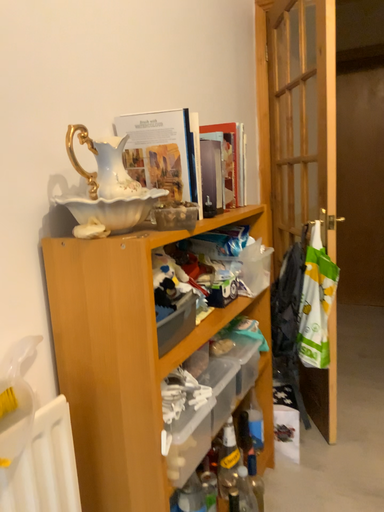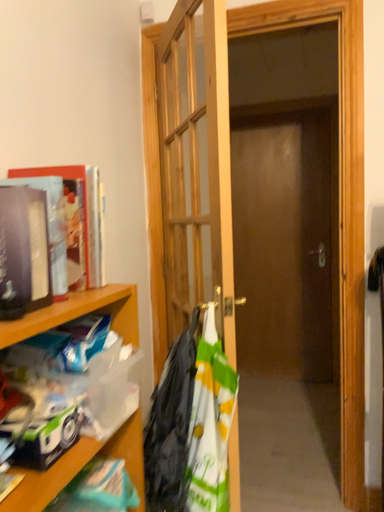
Question: Which way did the camera rotate in the video?

Choices:
 (A) rotated right
 (B) rotated left

Answer: (A)